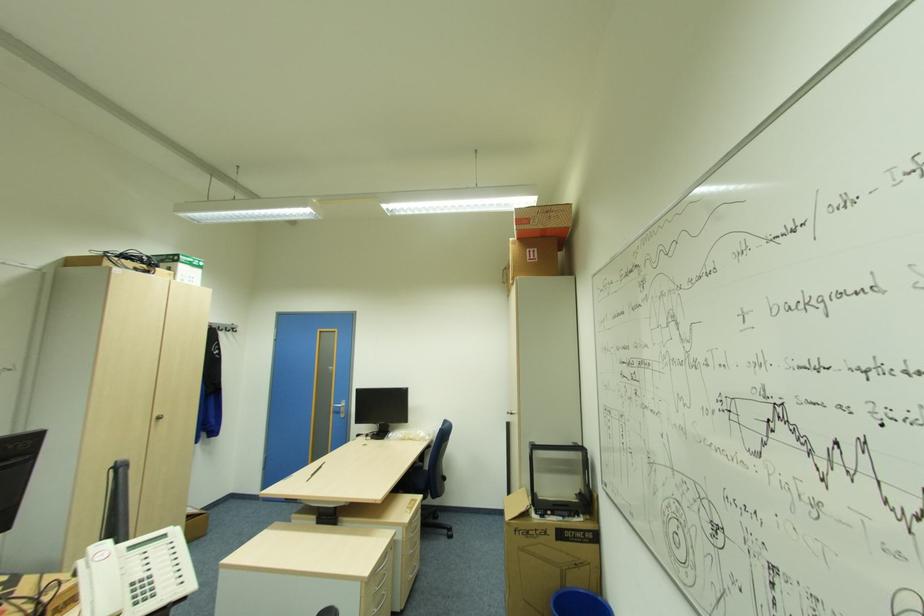
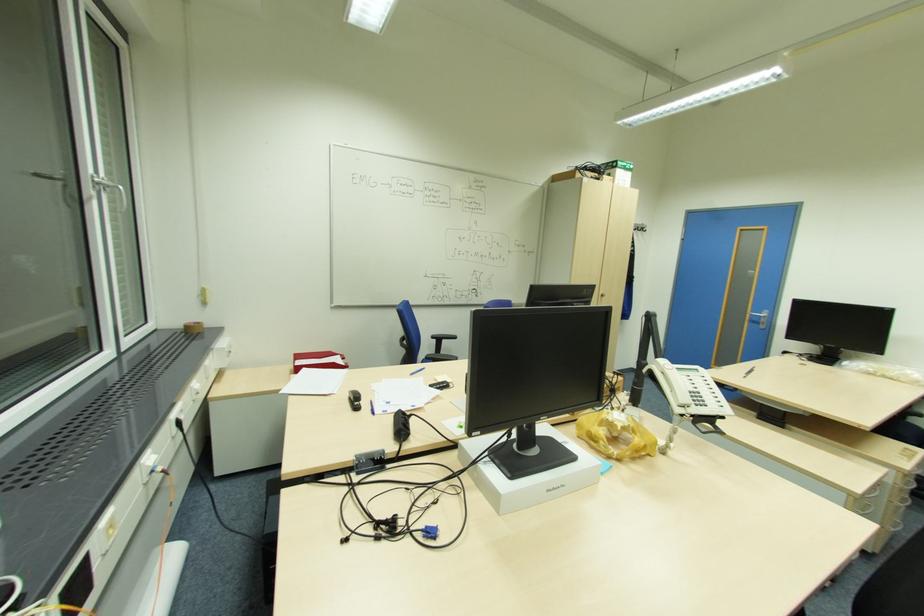
Where in the second image is the point corresponding to (369,582) from the first image?

(857, 498)